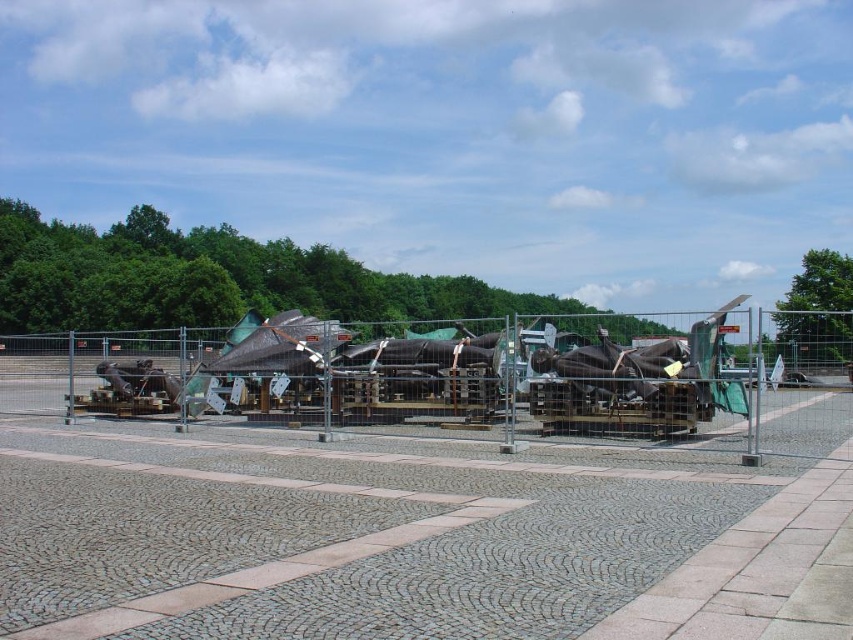
Who is higher up, cobblestone pavement at center or metal wire fence at center?

Positioned higher is metal wire fence at center.

Can you confirm if cobblestone pavement at center is shorter than metal wire fence at center?

Yes, cobblestone pavement at center is shorter than metal wire fence at center.

Is point (219, 570) farther from camera compared to point (3, 385)?

No, it is not.

At what (x,y) coordinates should I click in order to perform the action: click on cobblestone pavement at center. Please return your answer as a coordinate pair (x, y). Looking at the image, I should click on (407, 540).